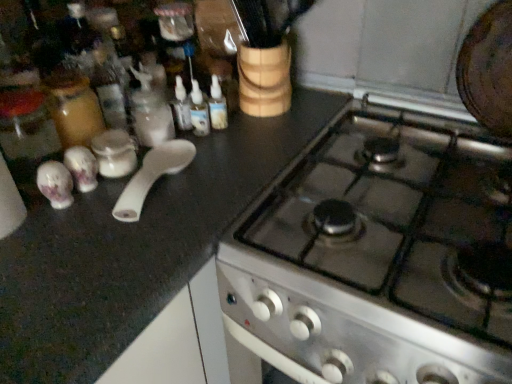
Question: Does translucent plastic bottles at center, the first bottle positioned from the left, have a lesser width compared to white plastic spoon at left?

Choices:
 (A) no
 (B) yes

Answer: (B)

Question: Is translucent plastic bottles at center, the 2th bottle viewed from the right, with white plastic spoon at left?

Choices:
 (A) yes
 (B) no

Answer: (B)

Question: From a real-world perspective, is translucent plastic bottles at center, the 2th bottle viewed from the right, located beneath white plastic spoon at left?

Choices:
 (A) no
 (B) yes

Answer: (A)

Question: Is white plastic spoon at left a part of translucent plastic bottles at center, the first bottle positioned from the left?

Choices:
 (A) no
 (B) yes

Answer: (A)

Question: From the image's perspective, is translucent plastic bottles at center, the 2th bottle viewed from the right, above white plastic spoon at left?

Choices:
 (A) yes
 (B) no

Answer: (A)

Question: In terms of height, does translucent plastic bottles at center, the first bottle positioned from the left, look taller or shorter compared to white glossy salt and pepper shakers at left?

Choices:
 (A) tall
 (B) short

Answer: (A)

Question: Does point (195, 112) appear closer or farther from the camera than point (68, 165)?

Choices:
 (A) farther
 (B) closer

Answer: (A)

Question: Based on their positions, is translucent plastic bottles at center, the first bottle positioned from the left, located to the left or right of white glossy salt and pepper shakers at left?

Choices:
 (A) left
 (B) right

Answer: (B)

Question: From a real-world perspective, is translucent plastic bottles at center, the 2th bottle viewed from the right, positioned above or below white glossy salt and pepper shakers at left?

Choices:
 (A) below
 (B) above

Answer: (B)

Question: Relative to white plastic spoon at left, is white glossy salt and pepper shakers at left in front or behind?

Choices:
 (A) behind
 (B) front

Answer: (A)

Question: From the image's perspective, is white glossy salt and pepper shakers at left above or below white plastic spoon at left?

Choices:
 (A) below
 (B) above

Answer: (B)

Question: Choose the correct answer: Is white glossy salt and pepper shakers at left inside white plastic spoon at left or outside it?

Choices:
 (A) outside
 (B) inside

Answer: (A)

Question: From a real-world perspective, is white glossy salt and pepper shakers at left positioned above or below white plastic spoon at left?

Choices:
 (A) above
 (B) below

Answer: (A)

Question: In the image, is white glossy spoon at upper left positioned in front of or behind white plastic spoon at left?

Choices:
 (A) front
 (B) behind

Answer: (B)

Question: In terms of height, does white glossy spoon at upper left look taller or shorter compared to white plastic spoon at left?

Choices:
 (A) tall
 (B) short

Answer: (A)